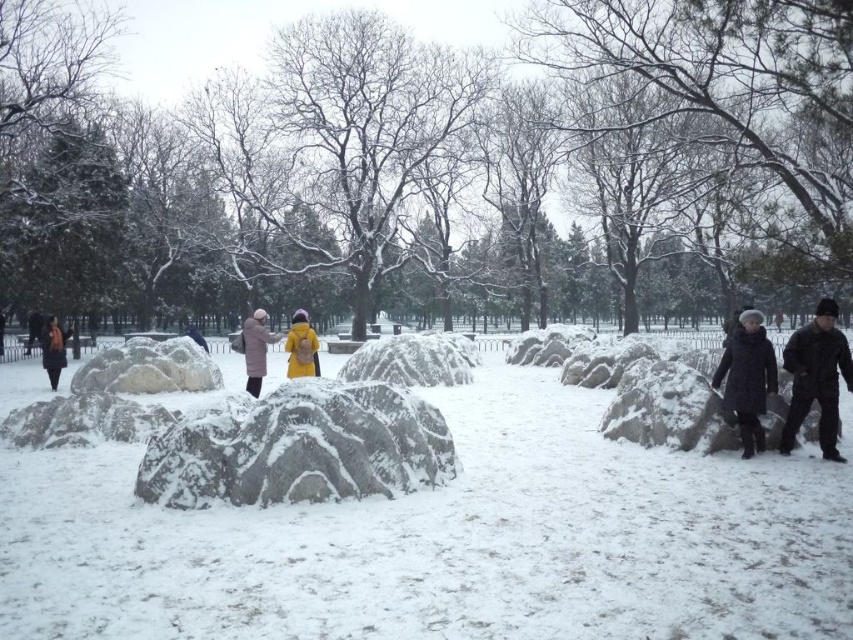
Is point (30, 316) closer to camera compared to point (196, 326)?

Yes, point (30, 316) is closer to viewer.

From the picture: Between matte black jacket at left and yellow woolen coat at center, which one is positioned lower?

yellow woolen coat at center is below.

Locate an element on the screen. matte black jacket at left is located at coordinates (33, 330).

Does yellow matte jacket at center appear over matte black jacket at left?

No.

Which is above, yellow matte jacket at center or matte black jacket at left?

matte black jacket at left

At what (x,y) coordinates should I click in order to perform the action: click on yellow matte jacket at center. Please return your answer as a coordinate pair (x, y). Looking at the image, I should click on (300, 348).

Which is more to the right, white textured snow at center or black matte jacket at right?

From the viewer's perspective, black matte jacket at right appears more on the right side.

Which is behind, point (293, 621) or point (827, 355)?

The point (827, 355) is behind.

This screenshot has height=640, width=853. Identify the location of white textured snow at center. (447, 540).